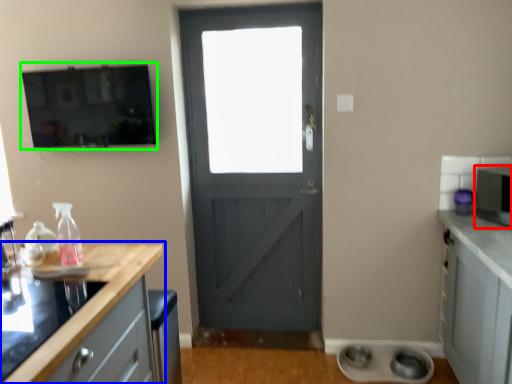
Question: Which object is the farthest from appliance (highlighted by a red box)? Choose among these: countertop (highlighted by a blue box) or window screen (highlighted by a green box).

Choices:
 (A) countertop
 (B) window screen

Answer: (B)